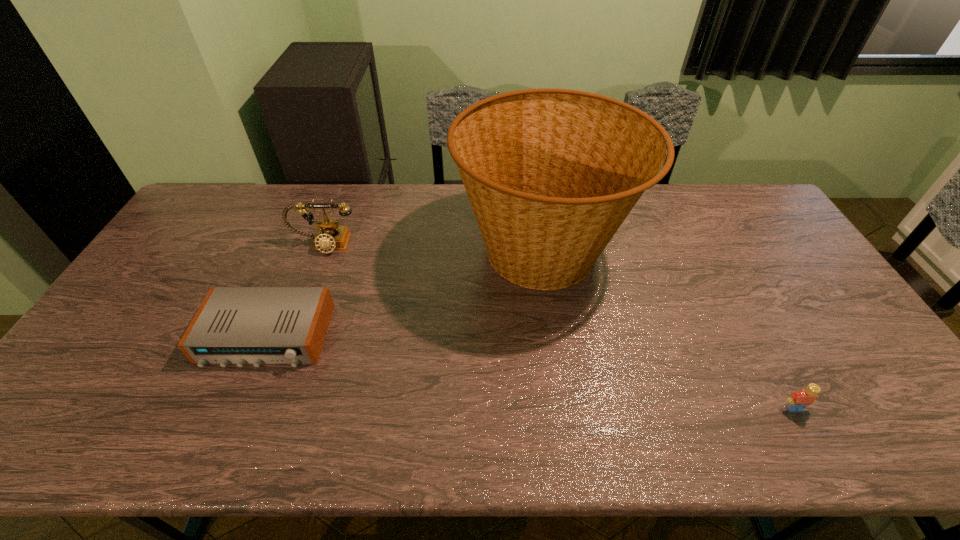
You are a GUI agent. You are given a task and a screenshot of the screen. Output one action in this format:
    pyautogui.click(x=<x>, y=<y>)
    Task: Click on the vacant space at the far edge of the desktop
    The width and height of the screenshot is (960, 540).
    Given the screenshot: What is the action you would take?
    pyautogui.click(x=673, y=212)

In the image, there is a desktop. Where is `free space at the near edge`? free space at the near edge is located at coordinates (125, 433).

At what (x,y) coordinates should I click in order to perform the action: click on vacant space in between the third object from left to right and the telephone. Please return your answer as a coordinate pair (x, y). The image size is (960, 540). Looking at the image, I should click on pyautogui.click(x=433, y=248).

You are a GUI agent. You are given a task and a screenshot of the screen. Output one action in this format:
    pyautogui.click(x=<x>, y=<y>)
    Task: Click on the free space between the tallest object and the second tallest object
    The width and height of the screenshot is (960, 540).
    Given the screenshot: What is the action you would take?
    click(x=433, y=248)

Image resolution: width=960 pixels, height=540 pixels. Find the location of `vacant space in between the third tallest object and the telephone`. vacant space in between the third tallest object and the telephone is located at coordinates (559, 327).

Where is `vacant area that lies between the nearest object and the shortest object`? The height and width of the screenshot is (540, 960). vacant area that lies between the nearest object and the shortest object is located at coordinates (530, 372).

This screenshot has height=540, width=960. In order to click on free space between the third object from left to right and the rightmost object in this screenshot , I will do `click(668, 330)`.

Point out which object is positioned as the second nearest to the shortest object. Please provide its 2D coordinates. Your answer should be formatted as a tuple, i.e. [(x, y)], where the tuple contains the x and y coordinates of a point satisfying the conditions above.

[(551, 174)]

The width and height of the screenshot is (960, 540). Identify the location of object that ranks as the closest to the nearest object. (551, 174).

In order to click on vacant region that satisfies the following two spatial constraints: 1. on the dial number of the tallest object; 2. on the left side of the third shortest object in this screenshot , I will do `click(321, 252)`.